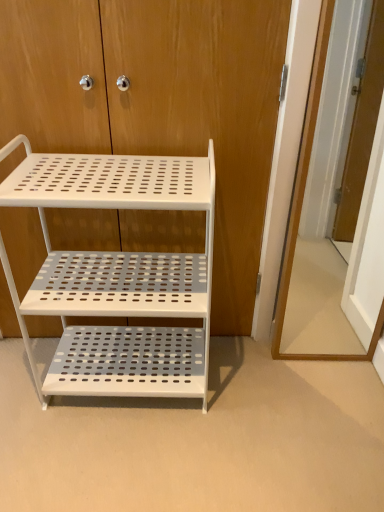
Where is `free space in front of white perforated metal shelf at center`? Image resolution: width=384 pixels, height=512 pixels. free space in front of white perforated metal shelf at center is located at coordinates (135, 457).